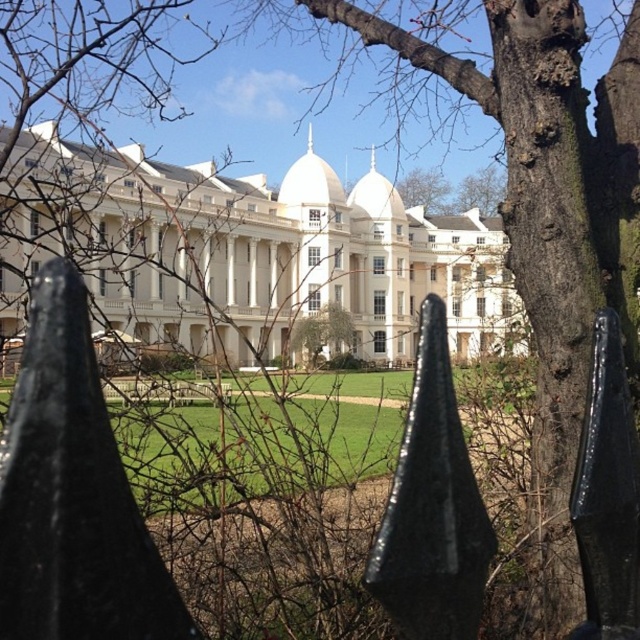
Question: Which point is farther to the camera?

Choices:
 (A) white smooth palace at center
 (B) bare branches at upper center
 (C) green leafy tree at center
 (D) smooth bark tree at center

Answer: (B)

Question: Which point is closer to the camera taking this photo?

Choices:
 (A) (128, 220)
 (B) (218, 384)

Answer: (B)

Question: Can you confirm if smooth bark tree at center is smaller than black metal fence at center?

Choices:
 (A) no
 (B) yes

Answer: (A)

Question: Can you confirm if black metal fence at center is smaller than green leafy tree at center?

Choices:
 (A) no
 (B) yes

Answer: (A)

Question: Which point is closer to the camera?

Choices:
 (A) smooth bark tree at center
 (B) bare branches at upper center

Answer: (A)

Question: Does smooth bark tree at center have a greater width compared to bare branches at upper center?

Choices:
 (A) no
 (B) yes

Answer: (B)